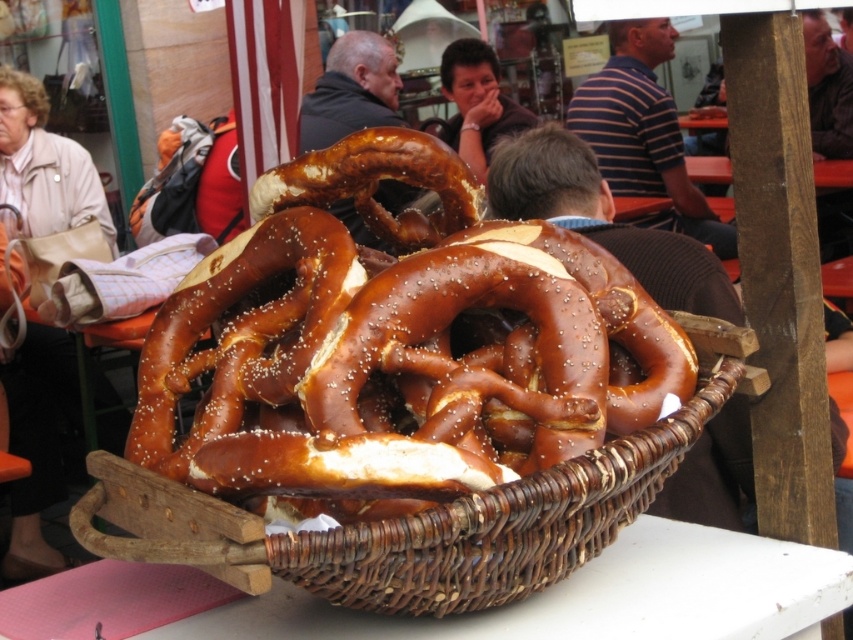
You are at a market and see the brown woven basket at center and the smooth brown hair at upper center. Which object is positioned more to the left?

The brown woven basket at center is positioned more to the left than the smooth brown hair at upper center.

You are at a market and see the brown wicker basket at center and the striped cotton shirt at upper center. Which object is positioned to the left of the other?

The brown wicker basket at center is to the left of striped cotton shirt at upper center.